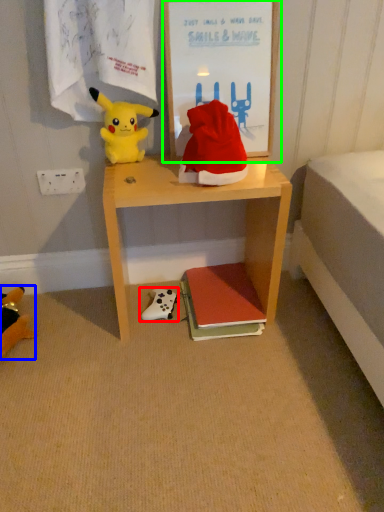
Question: Which object is positioned closest to toy (highlighted by a red box)? Select from toy (highlighted by a blue box) and picture frame (highlighted by a green box).

Choices:
 (A) toy
 (B) picture frame

Answer: (A)